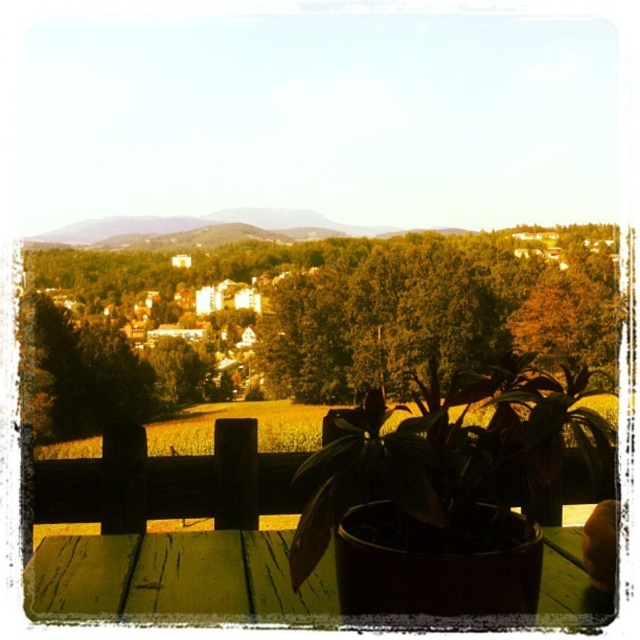
Question: Among these objects, which one is nearest to the camera?

Choices:
 (A) green matte plant at center
 (B) green wood picnic table at center

Answer: (A)

Question: Which point is farther to the camera?

Choices:
 (A) (124, 580)
 (B) (464, 564)

Answer: (A)

Question: Which point is closer to the camera?

Choices:
 (A) green matte plant at center
 (B) green wood picnic table at center

Answer: (A)

Question: Does green matte plant at center come behind green wood picnic table at center?

Choices:
 (A) yes
 (B) no

Answer: (B)

Question: Is green matte plant at center smaller than green wood picnic table at center?

Choices:
 (A) no
 (B) yes

Answer: (A)

Question: Does green matte plant at center have a smaller size compared to green wood picnic table at center?

Choices:
 (A) yes
 (B) no

Answer: (B)